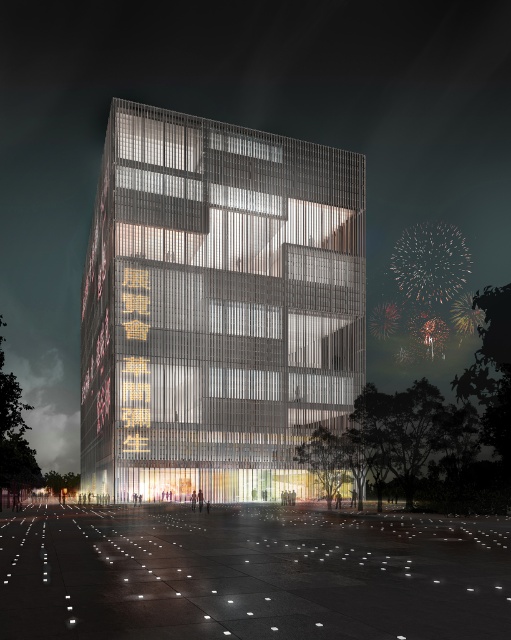
You are standing at the edge of the plaza and want to take a photo of the building. Since the plaza is reflective, you need to ensure that the entire building fits within the reflection. Based on their widths, will the white concrete plaza at lower center be wide enough to capture the entire metallic glass tower at center in its reflection?

The metallic glass tower at center is wider than the white concrete plaza at lower center, so the plaza will not be wide enough to fully capture the entire tower in its reflection.

Consider the image. You are standing in the plaza in front of the building and want to take a photo of the metallic glass tower at center. Where should you position yourself to capture the tower in the frame?

You should position yourself in the plaza in front of the building, aiming your camera towards the coordinates point at (x=245, y=272) to capture the metallic glass tower at center in the frame.